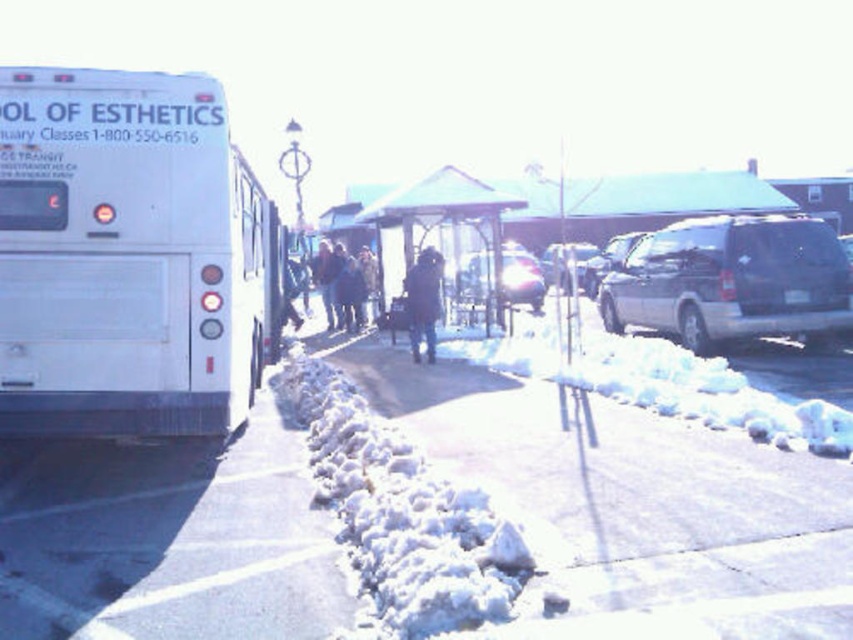
Question: Is white snow-covered pavement at center closer to camera compared to shiny silver van at center?

Choices:
 (A) yes
 (B) no

Answer: (A)

Question: Which of the following is the closest to the observer?

Choices:
 (A) dark brown leather jacket at center
 (B) white snow-covered pavement at center

Answer: (B)

Question: Is silver metallic van at right positioned behind transparent glass bus stop at center?

Choices:
 (A) yes
 (B) no

Answer: (B)

Question: Which object is closer to the camera taking this photo?

Choices:
 (A) shiny silver van at center
 (B) dark brown leather jacket at center

Answer: (A)

Question: Is silver metallic van at right positioned behind dark brown leather jacket at center?

Choices:
 (A) yes
 (B) no

Answer: (B)

Question: Which object is farther from the camera taking this photo?

Choices:
 (A) satin silver van at right
 (B) white matte bus at left
 (C) metallic silver van at center
 (D) dark brown leather jacket at center

Answer: (C)